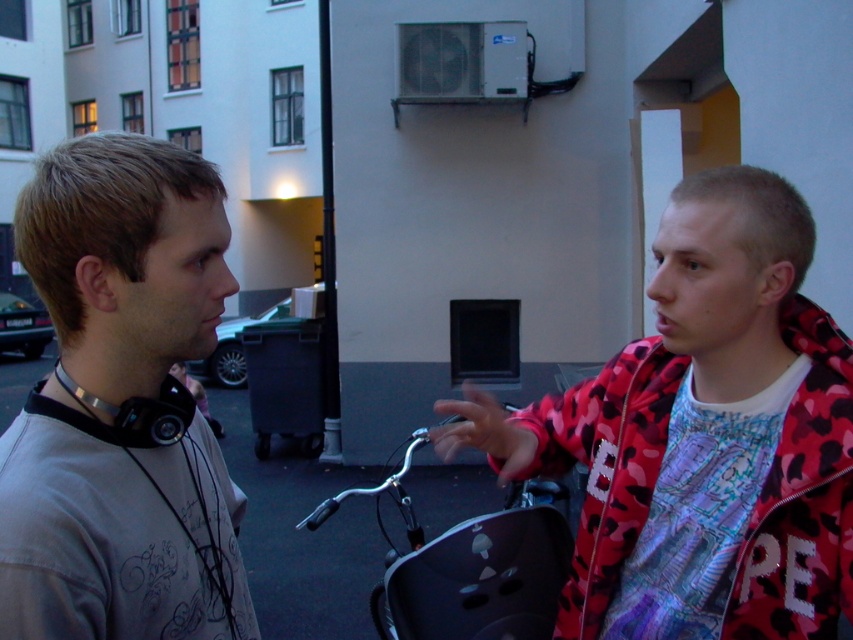
Does gray matte shirt at left have a greater height compared to camouflage-patterned jacket at right?

Yes, gray matte shirt at left is taller than camouflage-patterned jacket at right.

Who is more forward, (131, 540) or (811, 499)?

Point (131, 540) is in front.

Find the location of `gray matte shirt at left`. gray matte shirt at left is located at coordinates (120, 404).